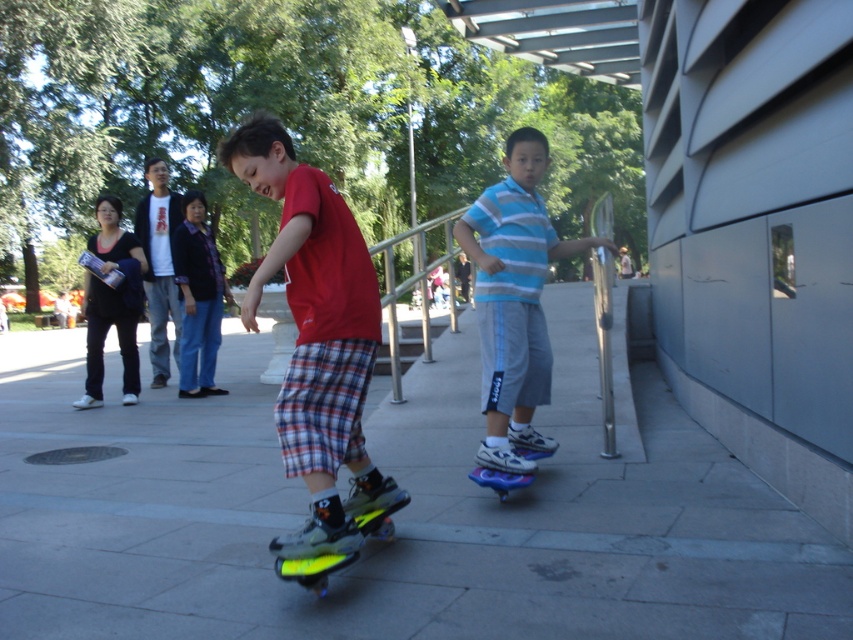
Between neon yellow roller skates at center and shiny blue skateboard at lower center, which one is positioned higher?

neon yellow roller skates at center is above.

The height and width of the screenshot is (640, 853). What do you see at coordinates (316, 337) in the screenshot?
I see `neon yellow roller skates at center` at bounding box center [316, 337].

At what (x,y) coordinates should I click in order to perform the action: click on neon yellow roller skates at center. Please return your answer as a coordinate pair (x, y). Looking at the image, I should click on (316, 337).

Is neon yellow roller skates at center wider than neon yellow inline skate at center?

Yes, neon yellow roller skates at center is wider than neon yellow inline skate at center.

Between neon yellow roller skates at center and neon yellow inline skate at center, which one is positioned lower?

neon yellow inline skate at center

Locate an element on the screen. This screenshot has width=853, height=640. neon yellow roller skates at center is located at coordinates (316, 337).

Does point (331, 401) come farther from viewer compared to point (218, 257)?

No, it is in front of (218, 257).

This screenshot has width=853, height=640. Find the location of `neon yellow roller skates at center`. neon yellow roller skates at center is located at coordinates (316, 337).

The height and width of the screenshot is (640, 853). Find the location of `neon yellow roller skates at center`. neon yellow roller skates at center is located at coordinates (316, 337).